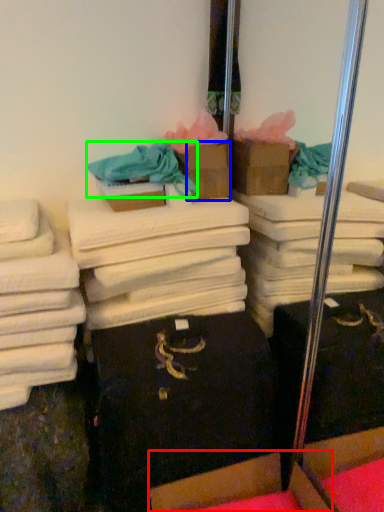
Question: Which object is positioned farthest from cardboard box (highlighted by a red box)? Select from cardboard box (highlighted by a blue box) and clothing (highlighted by a green box).

Choices:
 (A) cardboard box
 (B) clothing

Answer: (B)